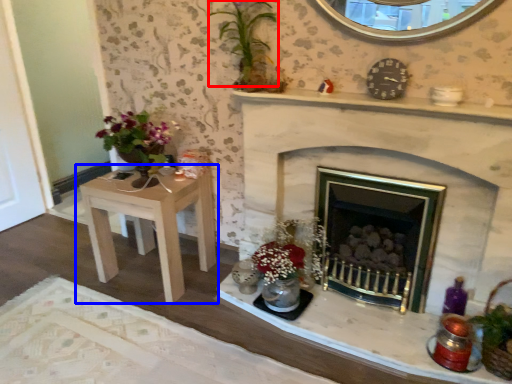
Question: Among these objects, which one is farthest to the camera, orchid (highlighted by a red box) or table (highlighted by a blue box)?

Choices:
 (A) orchid
 (B) table

Answer: (B)